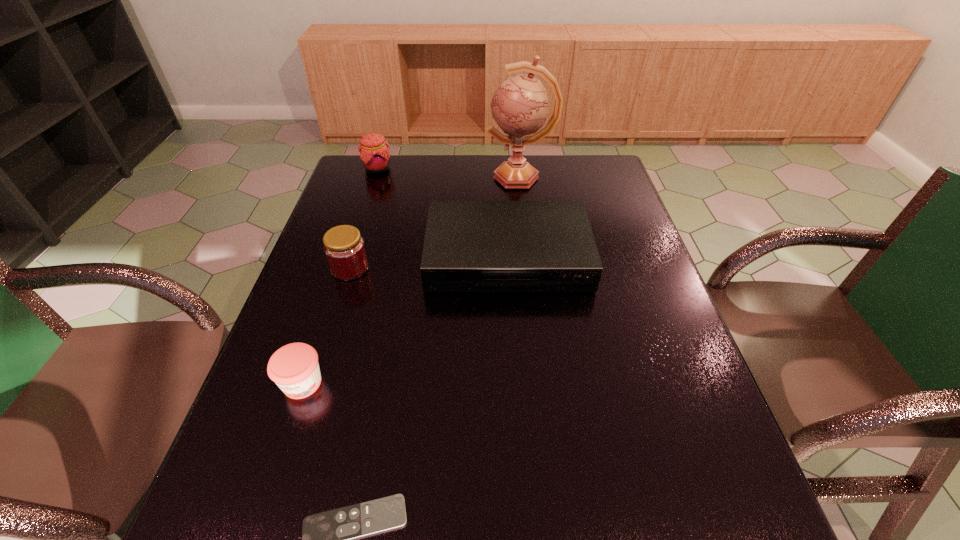
At what (x,y) coordinates should I click in order to perform the action: click on free spot between the second farthest jam and the farthest jam. Please return your answer as a coordinate pair (x, y). Image resolution: width=960 pixels, height=540 pixels. Looking at the image, I should click on (364, 218).

This screenshot has height=540, width=960. What are the coordinates of `empty space that is in between the shortest jam and the second nearest jam` in the screenshot? It's located at (326, 326).

Locate an element on the screen. This screenshot has height=540, width=960. vacant space that's between the second nearest jam and the farthest jam is located at coordinates (364, 218).

Identify which object is the fourth nearest to the shortest object. Please provide its 2D coordinates. Your answer should be formatted as a tuple, i.e. [(x, y)], where the tuple contains the x and y coordinates of a point satisfying the conditions above.

[(520, 107)]

Identify which object is the third nearest to the second nearest jam. Please provide its 2D coordinates. Your answer should be formatted as a tuple, i.e. [(x, y)], where the tuple contains the x and y coordinates of a point satisfying the conditions above.

[(374, 154)]

Point out which jam is positioned as the third nearest to the CD player. Please provide its 2D coordinates. Your answer should be formatted as a tuple, i.e. [(x, y)], where the tuple contains the x and y coordinates of a point satisfying the conditions above.

[(374, 154)]

Select which jam appears as the second closest to the farthest jam. Please provide its 2D coordinates. Your answer should be formatted as a tuple, i.e. [(x, y)], where the tuple contains the x and y coordinates of a point satisfying the conditions above.

[(294, 367)]

You are a GUI agent. You are given a task and a screenshot of the screen. Output one action in this format:
    pyautogui.click(x=<x>, y=<y>)
    Task: Click on the vacant area in the image that satisfies the following two spatial constraints: 1. on the front-facing side of the tallest object; 2. at the front of the CD player for disc insertion
    
    Given the screenshot: What is the action you would take?
    pyautogui.click(x=529, y=257)

Locate an element on the screen. This screenshot has width=960, height=540. vacant point that satisfies the following two spatial constraints: 1. on the front-facing side of the globe; 2. at the front of the CD player for disc insertion is located at coordinates (529, 257).

Where is `vacant space that satisfies the following two spatial constraints: 1. on the front side of the second nearest jam; 2. on the right side of the farthest jam`? vacant space that satisfies the following two spatial constraints: 1. on the front side of the second nearest jam; 2. on the right side of the farthest jam is located at coordinates [345, 268].